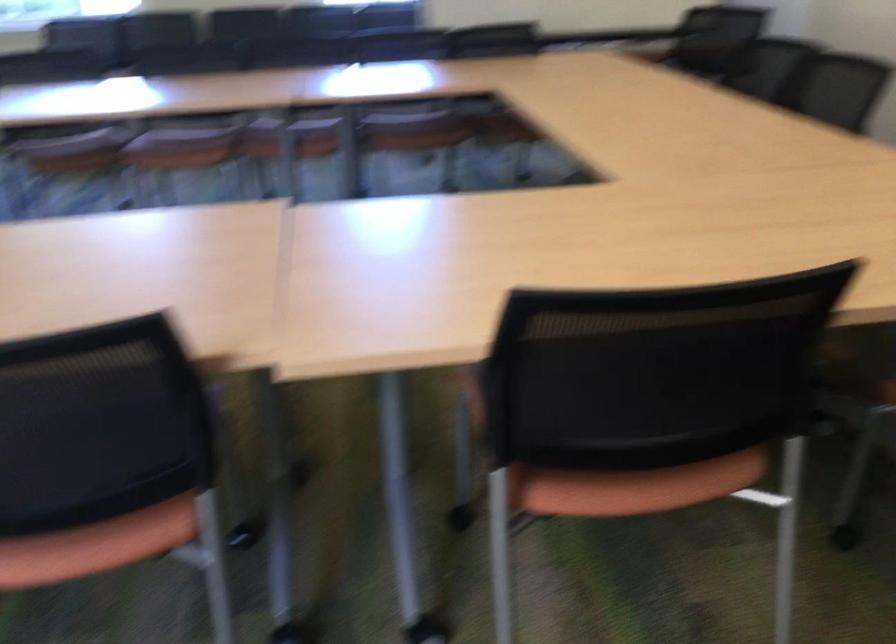
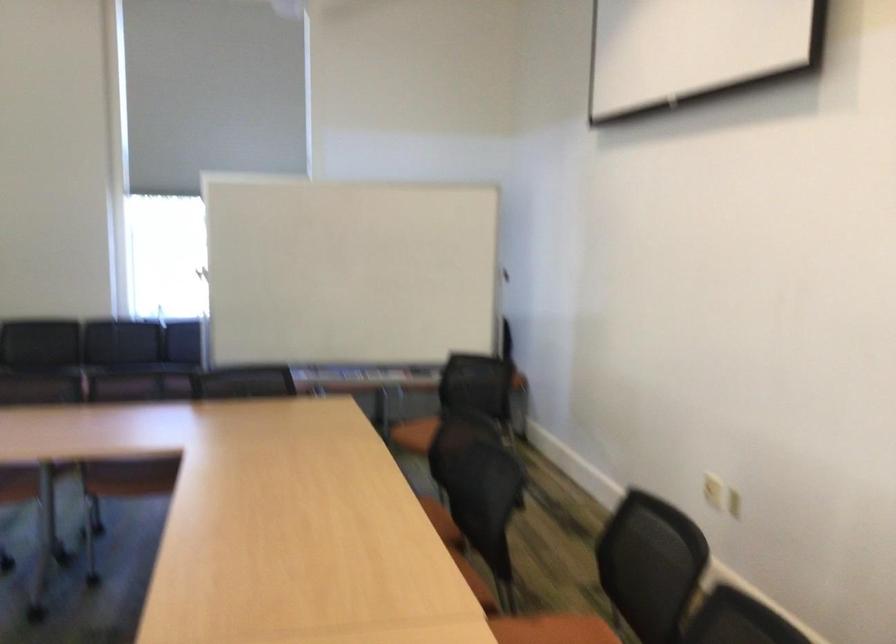
Question: Which direction would the cameraman need to move to produce the second image? Reply with the corresponding letter.

Choices:
 (A) Left
 (B) Right
 (C) Forward
 (D) Backward

Answer: (B)